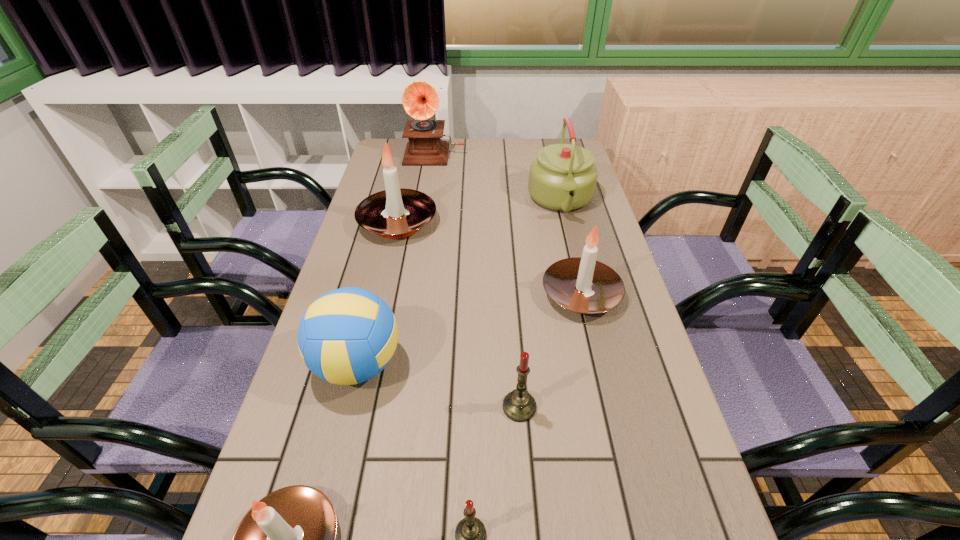
Where is `candle located in the right edge section of the desktop`? This screenshot has height=540, width=960. candle located in the right edge section of the desktop is located at coordinates (583, 285).

Where is `object that is at the far left corner`? object that is at the far left corner is located at coordinates (420, 100).

The height and width of the screenshot is (540, 960). I want to click on free space at the far edge, so (x=497, y=163).

The width and height of the screenshot is (960, 540). I want to click on free space at the left edge of the desktop, so pyautogui.click(x=274, y=451).

Where is `free space at the far left corner of the desktop`? The image size is (960, 540). free space at the far left corner of the desktop is located at coordinates (389, 142).

Identify the location of free point between the fourth farthest object and the farthest object. The height and width of the screenshot is (540, 960). (508, 224).

The width and height of the screenshot is (960, 540). I want to click on blank region between the biggest white candle and the phonograph record, so click(417, 188).

Where is `vacant space that is in between the third nearest candle and the rightmost candle`? vacant space that is in between the third nearest candle and the rightmost candle is located at coordinates (550, 350).

Locate an element on the screen. This screenshot has width=960, height=540. blank region between the farthest object and the farther red candle is located at coordinates tap(477, 280).

You are a GUI agent. You are given a task and a screenshot of the screen. Output one action in this format:
    pyautogui.click(x=<x>, y=<y>)
    Task: Click on the free spot between the phonograph record and the rightmost white candle
    The image size is (960, 540).
    Given the screenshot: What is the action you would take?
    pyautogui.click(x=508, y=224)